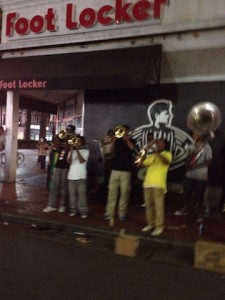
Where is `white pillar`? Image resolution: width=225 pixels, height=300 pixels. white pillar is located at coordinates (13, 126).